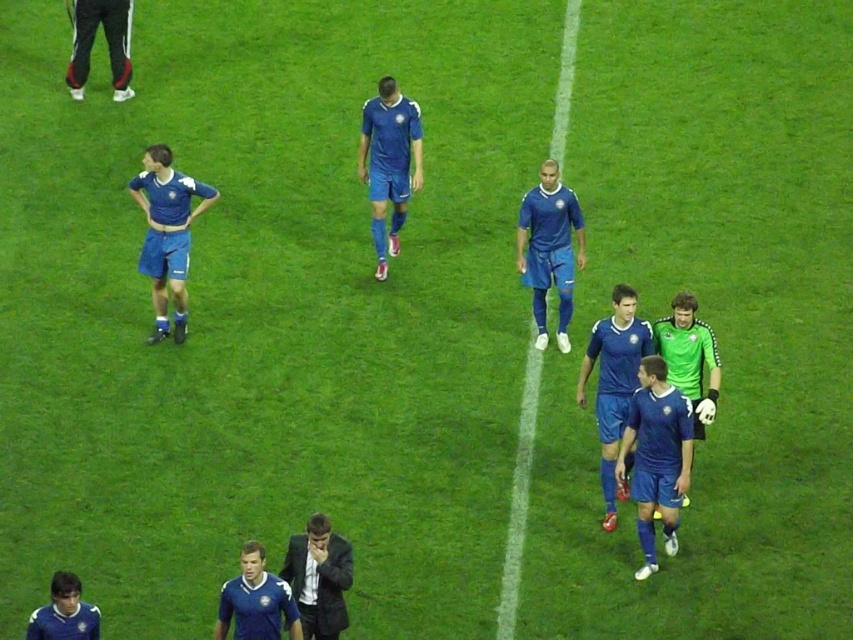
You are a photographer positioned at the center of the soccer field. You need to take a photo that includes both the matte blue uniform at left and the blue jersey at lower left. Which object should you adjust your camera angle to focus on first to ensure both are in frame?

The matte blue uniform at left is much taller than the blue jersey at lower left, so you should focus on the taller matte blue uniform at left first to ensure it fits within the camera frame before adjusting for the shorter blue jersey at lower left.

You are a photographer positioned at the edge of the soccer field. You need to take a photo that includes both the blue matte soccer jersey at center and the matte blue uniform at left. Based on their positions, which one should you adjust your camera angle to focus on first to ensure both are in frame?

The blue matte soccer jersey at center is to the right of the matte blue uniform at left. To include both in the frame, focus on the matte blue uniform at left first, then adjust the angle to include the jersey at center to the right.